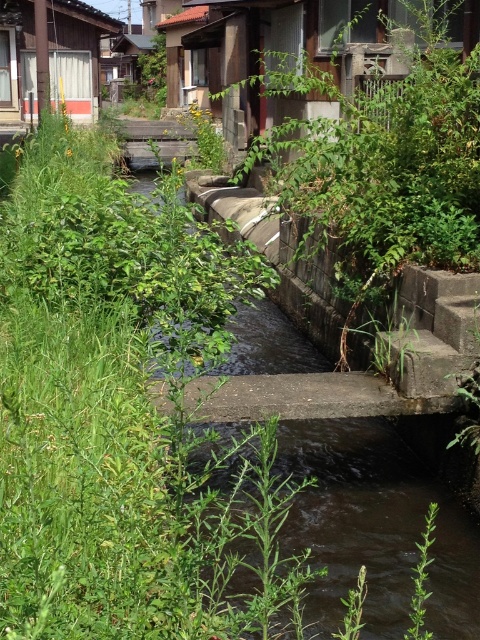
Which is in front, point (58, 38) or point (421, 596)?

Point (421, 596)

Can you confirm if wooden hut at upper left is shorter than green leafy plant at lower right?

In fact, wooden hut at upper left may be taller than green leafy plant at lower right.

This screenshot has width=480, height=640. What do you see at coordinates (75, 54) in the screenshot? I see `wooden hut at upper left` at bounding box center [75, 54].

You are a GUI agent. You are given a task and a screenshot of the screen. Output one action in this format:
    pyautogui.click(x=<x>, y=<y>)
    Task: Click on the wooden hut at upper left
    This screenshot has width=480, height=640.
    Given the screenshot: What is the action you would take?
    pyautogui.click(x=75, y=54)

Does dark brown water at center have a greater width compared to wooden hut at upper center?

No, dark brown water at center is not wider than wooden hut at upper center.

What do you see at coordinates (375, 528) in the screenshot? This screenshot has height=640, width=480. I see `dark brown water at center` at bounding box center [375, 528].

Is point (471, 616) less distant than point (222, 51)?

Yes, point (471, 616) is closer to viewer.

The width and height of the screenshot is (480, 640). I want to click on dark brown water at center, so click(375, 528).

Which is more to the right, wooden hut at upper center or green leafy plant at lower right?

green leafy plant at lower right

Between wooden hut at upper center and green leafy plant at lower right, which one is positioned higher?

wooden hut at upper center is higher up.

Who is more forward, (457,28) or (427,522)?

Point (427,522) is in front.

At what (x,y) coordinates should I click in order to perform the action: click on wooden hut at upper center. Please return your answer as a coordinate pair (x, y). This screenshot has width=480, height=640. Looking at the image, I should click on (304, 33).